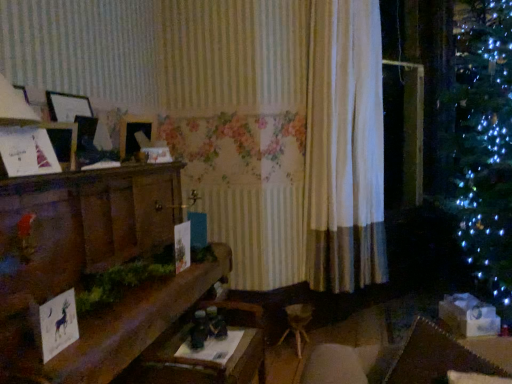
Question: Is white paper christmas card at left, the second christmas card when ordered from right to left, bigger than white paper card at lower left, which is the 2th christmas card in top-to-bottom order?

Choices:
 (A) no
 (B) yes

Answer: (B)

Question: Is white paper christmas card at left, marked as the 1th christmas card in a back-to-front arrangement, not inside white paper card at lower left, acting as the second christmas card starting from the back?

Choices:
 (A) yes
 (B) no

Answer: (A)

Question: From the image's perspective, is white paper christmas card at left, marked as the 1th christmas card in a back-to-front arrangement, above white paper card at lower left, the 1th christmas card positioned from the bottom?

Choices:
 (A) yes
 (B) no

Answer: (A)

Question: Is white paper christmas card at left, the second christmas card from the front, positioned with its back to white paper card at lower left, the 1th christmas card viewed from the right?

Choices:
 (A) yes
 (B) no

Answer: (B)

Question: Does white paper christmas card at left, marked as the 2th christmas card in a bottom-to-top arrangement, appear on the left side of white paper card at lower left, which is the 2th christmas card in top-to-bottom order?

Choices:
 (A) yes
 (B) no

Answer: (A)

Question: From a real-world perspective, relative to wooden table at center, is wooden mantelpiece at left vertically above or below?

Choices:
 (A) below
 (B) above

Answer: (B)

Question: Considering the positions of point (15, 362) and point (244, 332), is point (15, 362) closer or farther from the camera than point (244, 332)?

Choices:
 (A) farther
 (B) closer

Answer: (B)

Question: Choose the correct answer: Is wooden mantelpiece at left inside wooden table at center or outside it?

Choices:
 (A) inside
 (B) outside

Answer: (B)

Question: Looking at the image, does wooden mantelpiece at left seem bigger or smaller compared to wooden table at center?

Choices:
 (A) small
 (B) big

Answer: (B)

Question: Is wooden table at center spatially inside white fabric curtain at center, or outside of it?

Choices:
 (A) inside
 (B) outside

Answer: (B)

Question: Is wooden table at center to the left or to the right of white fabric curtain at center in the image?

Choices:
 (A) right
 (B) left

Answer: (B)

Question: In terms of width, does wooden table at center look wider or thinner when compared to white fabric curtain at center?

Choices:
 (A) thin
 (B) wide

Answer: (B)

Question: From a real-world perspective, relative to white fabric curtain at center, is wooden table at center vertically above or below?

Choices:
 (A) below
 (B) above

Answer: (A)

Question: Based on their sizes in the image, would you say wooden table at center is bigger or smaller than white paper card at lower left, the first christmas card in the front-to-back sequence?

Choices:
 (A) big
 (B) small

Answer: (A)

Question: From a real-world perspective, is wooden table at center above or below white paper card at lower left, the 2th christmas card in the left-to-right sequence?

Choices:
 (A) above
 (B) below

Answer: (B)